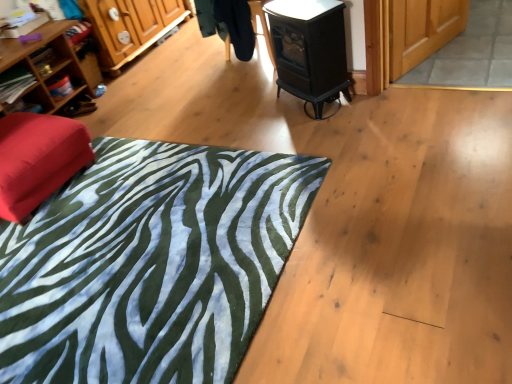
Question: From a real-world perspective, is wooden cabinet at left over wooden bookshelf at left, arranged as the 3th shelf when ordered from the bottom?

Choices:
 (A) yes
 (B) no

Answer: (A)

Question: Is wooden cabinet at left outside of wooden bookshelf at left, positioned as the first shelf in top-to-bottom order?

Choices:
 (A) no
 (B) yes

Answer: (B)

Question: Considering the relative sizes of wooden cabinet at left and wooden bookshelf at left, arranged as the 3th shelf when ordered from the bottom, in the image provided, is wooden cabinet at left smaller than wooden bookshelf at left, arranged as the 3th shelf when ordered from the bottom,?

Choices:
 (A) yes
 (B) no

Answer: (B)

Question: Is wooden cabinet at left shorter than wooden bookshelf at left, positioned as the first shelf in top-to-bottom order?

Choices:
 (A) no
 (B) yes

Answer: (A)

Question: Is wooden cabinet at left placed right next to wooden bookshelf at left, arranged as the 3th shelf when ordered from the bottom?

Choices:
 (A) no
 (B) yes

Answer: (A)

Question: From the image's perspective, would you say wooden cabinet at left is positioned over wooden bookshelf at left, arranged as the 3th shelf when ordered from the bottom?

Choices:
 (A) yes
 (B) no

Answer: (A)

Question: Is black glossy stove at upper center smaller than wooden bookshelf at left, arranged as the 3th shelf when ordered from the bottom?

Choices:
 (A) no
 (B) yes

Answer: (B)

Question: Can you confirm if black glossy stove at upper center is wider than wooden bookshelf at left, positioned as the first shelf in top-to-bottom order?

Choices:
 (A) no
 (B) yes

Answer: (A)

Question: Considering the relative positions of black glossy stove at upper center and wooden bookshelf at left, arranged as the 3th shelf when ordered from the bottom, in the image provided, is black glossy stove at upper center behind wooden bookshelf at left, arranged as the 3th shelf when ordered from the bottom,?

Choices:
 (A) no
 (B) yes

Answer: (A)

Question: Considering the relative positions of black glossy stove at upper center and wooden bookshelf at left, arranged as the 3th shelf when ordered from the bottom, in the image provided, is black glossy stove at upper center to the right of wooden bookshelf at left, arranged as the 3th shelf when ordered from the bottom, from the viewer's perspective?

Choices:
 (A) yes
 (B) no

Answer: (A)

Question: Is black glossy stove at upper center bigger than wooden bookshelf at left, positioned as the first shelf in top-to-bottom order?

Choices:
 (A) yes
 (B) no

Answer: (B)

Question: From the image's perspective, is black glossy stove at upper center on top of wooden bookshelf at left, arranged as the 3th shelf when ordered from the bottom?

Choices:
 (A) no
 (B) yes

Answer: (B)

Question: Does wooden bookshelf at left, arranged as the 3th shelf when ordered from the bottom, have a lesser height compared to green zebra-patterned rug at lower left?

Choices:
 (A) no
 (B) yes

Answer: (A)